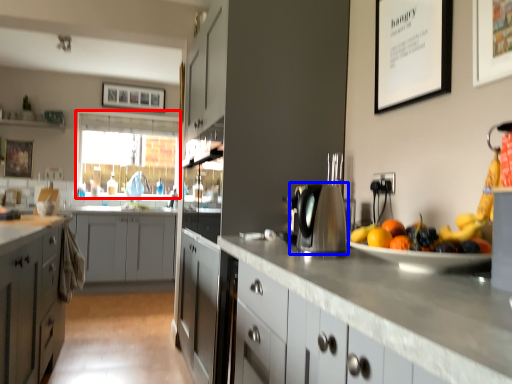
Question: Which point is further to the camera, window screen (highlighted by a red box) or kitchen appliance (highlighted by a blue box)?

Choices:
 (A) window screen
 (B) kitchen appliance

Answer: (A)